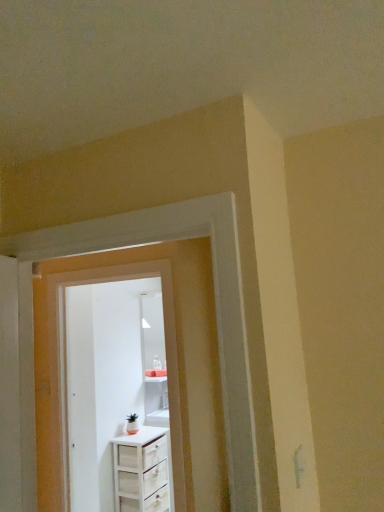
What is the approximate height of white wood door at center, the first door from the back?

white wood door at center, the first door from the back, is 5.65 feet in height.

This screenshot has width=384, height=512. Describe the element at coordinates (178, 370) in the screenshot. I see `white glossy door at center, the second door positioned from the back` at that location.

The width and height of the screenshot is (384, 512). I want to click on white wood chest of drawers at center, so click(142, 471).

From the image's perspective, does white wood door at center, the second door viewed from the front, appear higher than white glossy door at center, the 1th door in the front-to-back sequence?

No, from the image's perspective, white wood door at center, the second door viewed from the front, is not on top of white glossy door at center, the 1th door in the front-to-back sequence.

Between white wood door at center, the first door from the back, and white glossy door at center, the second door positioned from the back, which one is positioned in front?

Positioned in front is white glossy door at center, the second door positioned from the back.

Is white wood door at center, the second door viewed from the front, taller than white glossy door at center, the 1th door in the front-to-back sequence?

Yes.

How distant is white wood door at center, the second door viewed from the front, from white glossy door at center, the second door positioned from the back?

white wood door at center, the second door viewed from the front, and white glossy door at center, the second door positioned from the back, are 18.79 inches apart from each other.

Can you confirm if white glossy door at center, the 1th door in the front-to-back sequence, is shorter than white wood chest of drawers at center?

Incorrect, the height of white glossy door at center, the 1th door in the front-to-back sequence, does not fall short of that of white wood chest of drawers at center.

Is white wood chest of drawers at center a part of white glossy door at center, the 1th door in the front-to-back sequence?

No, white wood chest of drawers at center is located outside of white glossy door at center, the 1th door in the front-to-back sequence.

From the image's perspective, relative to white wood chest of drawers at center, is white glossy door at center, the 1th door in the front-to-back sequence, above or below?

Based on their image positions, white glossy door at center, the 1th door in the front-to-back sequence, is located above white wood chest of drawers at center.

From a real-world perspective, is white glossy door at center, the second door positioned from the back, beneath white wood chest of drawers at center?

No, from a real-world perspective, white glossy door at center, the second door positioned from the back, is not under white wood chest of drawers at center.

In terms of size, does white wood door at center, the second door viewed from the front, appear bigger or smaller than white wood chest of drawers at center?

In the image, white wood door at center, the second door viewed from the front, appears to be smaller than white wood chest of drawers at center.

From a real-world perspective, is white wood door at center, the second door viewed from the front, positioned above or below white wood chest of drawers at center?

white wood door at center, the second door viewed from the front, is situated higher than white wood chest of drawers at center in the real world.

Is white wood door at center, the first door from the back, taller than white wood chest of drawers at center?

Correct, white wood door at center, the first door from the back, is much taller as white wood chest of drawers at center.

What's the angular difference between white wood door at center, the first door from the back, and white wood chest of drawers at center's facing directions?

The facing directions of white wood door at center, the first door from the back, and white wood chest of drawers at center are 30.9 degrees apart.

Considering the positions of point (157, 499) and point (185, 326), is point (157, 499) closer or farther from the camera than point (185, 326)?

Point (157, 499).

Are white wood chest of drawers at center and white glossy door at center, the 1th door in the front-to-back sequence, beside each other?

There is a gap between white wood chest of drawers at center and white glossy door at center, the 1th door in the front-to-back sequence.

Looking at their sizes, would you say white wood chest of drawers at center is wider or thinner than white glossy door at center, the 1th door in the front-to-back sequence?

white wood chest of drawers at center is wider than white glossy door at center, the 1th door in the front-to-back sequence.

Is white wood chest of drawers at center shorter than white glossy door at center, the second door positioned from the back?

Yes, white wood chest of drawers at center is shorter than white glossy door at center, the second door positioned from the back.

You are a GUI agent. You are given a task and a screenshot of the screen. Output one action in this format:
    pyautogui.click(x=<x>, y=<y>)
    Task: Click on the chest of drawers below the white wood door at center, the first door from the back (from a real-world perspective)
    
    Given the screenshot: What is the action you would take?
    pyautogui.click(x=142, y=471)

Which of these two, white wood chest of drawers at center or white wood door at center, the second door viewed from the front, stands taller?

white wood door at center, the second door viewed from the front, is taller.

Is white wood chest of drawers at center facing towards white wood door at center, the second door viewed from the front?

No, white wood chest of drawers at center is not turned towards white wood door at center, the second door viewed from the front.

You are a GUI agent. You are given a task and a screenshot of the screen. Output one action in this format:
    pyautogui.click(x=<x>, y=<y>)
    Task: Click on the door behind the white glossy door at center, the second door positioned from the back
    Image resolution: width=384 pixels, height=512 pixels.
    Given the screenshot: What is the action you would take?
    pyautogui.click(x=82, y=400)

Choose the correct answer: Is white glossy door at center, the 1th door in the front-to-back sequence, inside white wood door at center, the first door from the back, or outside it?

white glossy door at center, the 1th door in the front-to-back sequence, exists outside the volume of white wood door at center, the first door from the back.

Is white glossy door at center, the second door positioned from the back, positioned with its back to white wood door at center, the first door from the back?

No, white glossy door at center, the second door positioned from the back,'s orientation is not away from white wood door at center, the first door from the back.

From the image's perspective, who appears lower, white glossy door at center, the second door positioned from the back, or white wood door at center, the second door viewed from the front?

white wood door at center, the second door viewed from the front, appears lower in the image.

Identify the location of door on the right of white wood door at center, the second door viewed from the front. The image size is (384, 512). (178, 370).

Where is `chest of drawers below the white glossy door at center, the 1th door in the front-to-back sequence (from the image's perspective)`? The width and height of the screenshot is (384, 512). chest of drawers below the white glossy door at center, the 1th door in the front-to-back sequence (from the image's perspective) is located at coordinates (142, 471).

From the image, which object appears to be farther from white wood chest of drawers at center, white wood door at center, the second door viewed from the front, or white glossy door at center, the second door positioned from the back?

white glossy door at center, the second door positioned from the back, is positioned further to the anchor white wood chest of drawers at center.

Which object lies further to the anchor point white glossy door at center, the 1th door in the front-to-back sequence, white wood chest of drawers at center or white wood door at center, the second door viewed from the front?

white wood chest of drawers at center.

Which object lies further to the anchor point white wood door at center, the second door viewed from the front, white glossy door at center, the second door positioned from the back, or white wood chest of drawers at center?

white glossy door at center, the second door positioned from the back, is further to white wood door at center, the second door viewed from the front.

Considering their positions, is white wood door at center, the first door from the back, positioned closer to white glossy door at center, the second door positioned from the back, than white wood chest of drawers at center?

Among the two, white wood door at center, the first door from the back, is located nearer to white glossy door at center, the second door positioned from the back.

Estimate the real-world distances between objects in this image. Which object is closer to white wood chest of drawers at center, white glossy door at center, the second door positioned from the back, or white wood door at center, the second door viewed from the front?

The object closer to white wood chest of drawers at center is white wood door at center, the second door viewed from the front.

When comparing their distances from white wood door at center, the second door viewed from the front, does white wood chest of drawers at center or white glossy door at center, the second door positioned from the back, seem closer?

white wood chest of drawers at center lies closer to white wood door at center, the second door viewed from the front, than the other object.

Where is `door between white glossy door at center, the 1th door in the front-to-back sequence, and white wood chest of drawers at center from front to back`? door between white glossy door at center, the 1th door in the front-to-back sequence, and white wood chest of drawers at center from front to back is located at coordinates (82, 400).